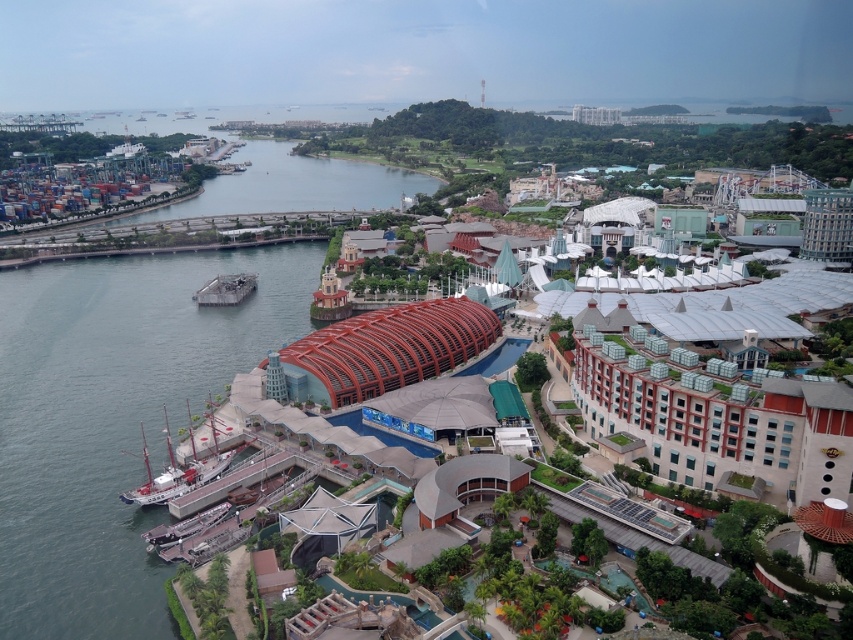
You are standing at the point with coordinates point (175, 492) and want to walk to the point with coordinates point (186, 321). According to the image, will you need to walk towards the foreground or the background?

You will need to walk towards the background because point (186, 321) is behind point (175, 492).

You are a tourist standing at the waterfront and want to take a photo of the gray concrete water at left and the wooden ship at lower left. Which object should you focus on first if you want to include both in your frame without moving your camera?

The gray concrete water at left is much taller than the wooden ship at lower left, so you should focus on the gray concrete water at left first to ensure it fits in the frame, then adjust to include the smaller wooden ship at lower left.